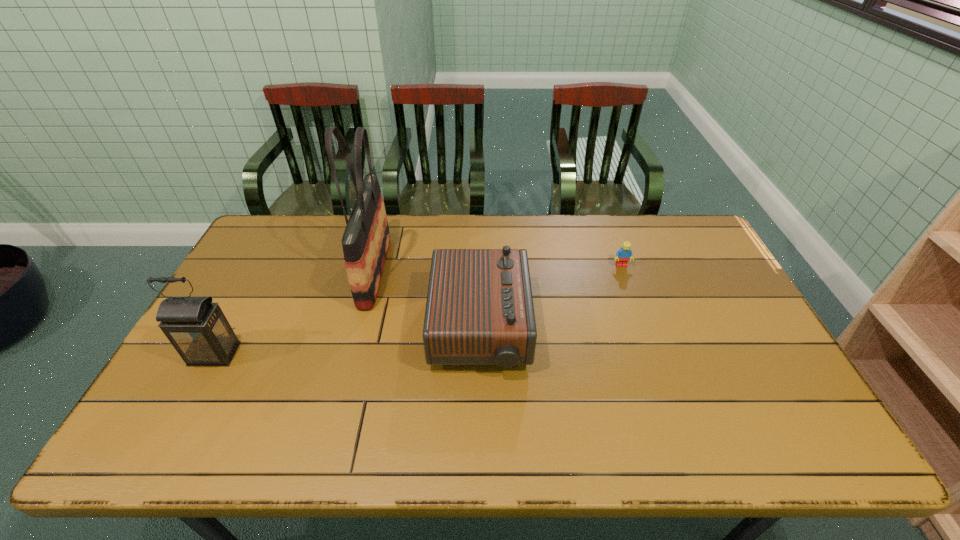
Where is `free space located 0.070m on the front panel of the radio receiver`? The height and width of the screenshot is (540, 960). free space located 0.070m on the front panel of the radio receiver is located at coordinates (552, 329).

At what (x,y) coordinates should I click in order to perform the action: click on free space located 0.340m on the face of the rightmost object. Please return your answer as a coordinate pair (x, y). Image resolution: width=960 pixels, height=540 pixels. Looking at the image, I should click on (652, 352).

Locate an element on the screen. object situated at the far edge is located at coordinates (366, 239).

You are a GUI agent. You are given a task and a screenshot of the screen. Output one action in this format:
    pyautogui.click(x=<x>, y=<y>)
    Task: Click on the object at the left edge
    The width and height of the screenshot is (960, 540).
    Given the screenshot: What is the action you would take?
    pyautogui.click(x=197, y=328)

In the image, there is a desktop. Where is `free space at the far edge`? This screenshot has width=960, height=540. free space at the far edge is located at coordinates (487, 228).

I want to click on vacant space at the near edge, so click(x=624, y=452).

Where is `blank space at the right edge of the desktop`? The width and height of the screenshot is (960, 540). blank space at the right edge of the desktop is located at coordinates (697, 269).

You are a GUI agent. You are given a task and a screenshot of the screen. Output one action in this format:
    pyautogui.click(x=<x>, y=<y>)
    Task: Click on the vacant space at the far left corner of the desktop
    Image resolution: width=960 pixels, height=540 pixels.
    Given the screenshot: What is the action you would take?
    pyautogui.click(x=274, y=247)

Locate an element on the screen. vacant space that is in between the radio receiver and the shortest object is located at coordinates (551, 298).

The image size is (960, 540). Find the location of `vacant region between the lantern and the radio receiver`. vacant region between the lantern and the radio receiver is located at coordinates (348, 342).